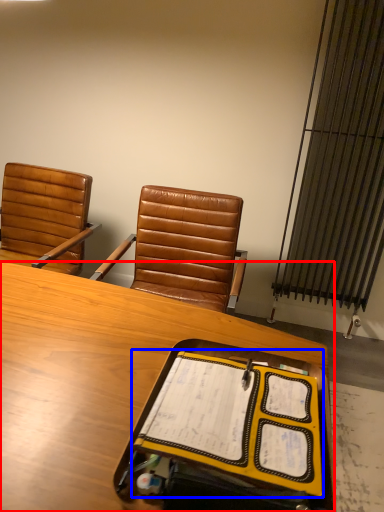
Question: Which point is closer to the camera, desk (highlighted by a red box) or notebook (highlighted by a blue box)?

Choices:
 (A) desk
 (B) notebook

Answer: (A)